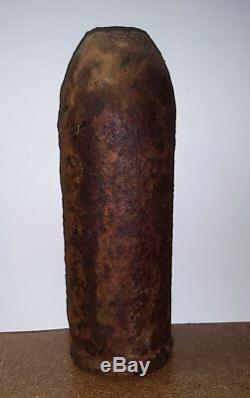
Identify the location of table top. This screenshot has height=398, width=250. (203, 355).